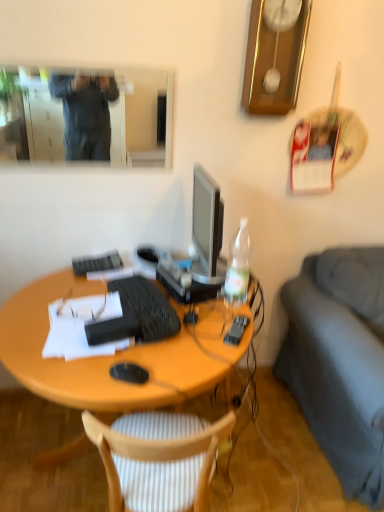
Find the location of a particular element. The image size is (384, 512). free space between black matte computer mouse at center and white paper at center is located at coordinates (110, 362).